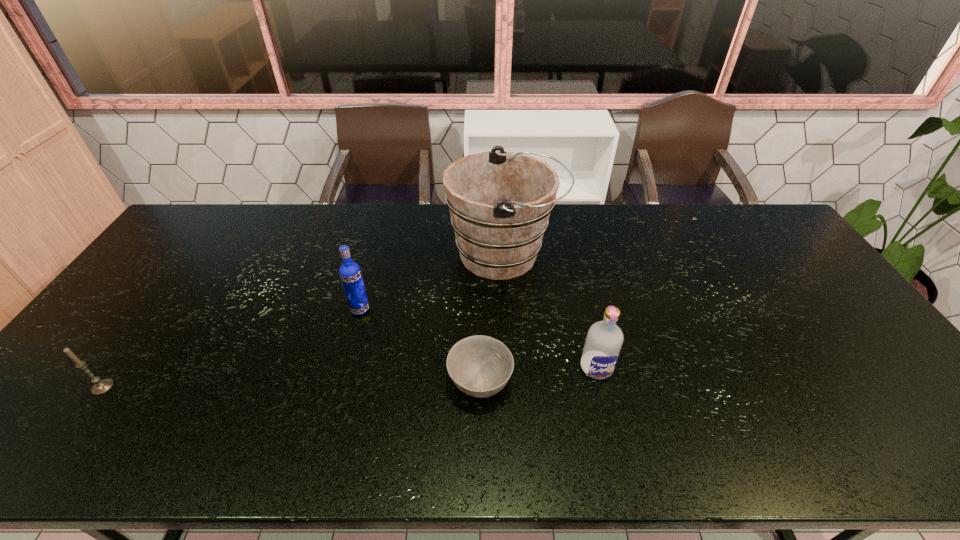
Identify the location of bucket. Image resolution: width=960 pixels, height=540 pixels. (500, 202).

The height and width of the screenshot is (540, 960). I want to click on the farthest object, so click(x=500, y=202).

Identify the location of the farther vodka. (350, 273).

This screenshot has width=960, height=540. In order to click on the left vodka in this screenshot , I will do `click(350, 273)`.

Where is `the nearer vodka`? the nearer vodka is located at coordinates (604, 340).

Locate an element on the screen. the second shortest object is located at coordinates (100, 386).

Find the location of a particular element. This screenshot has height=540, width=960. the leftmost object is located at coordinates (100, 386).

You are a GUI agent. You are given a task and a screenshot of the screen. Output one action in this format:
    pyautogui.click(x=<x>, y=<y>)
    Task: Click on the bowl
    
    Given the screenshot: What is the action you would take?
    pyautogui.click(x=480, y=366)

Identify the location of blank area located on the handle side of the farthest object. (583, 255).

What are the coordinates of `vacant space located on the left of the left vodka` in the screenshot? It's located at (329, 309).